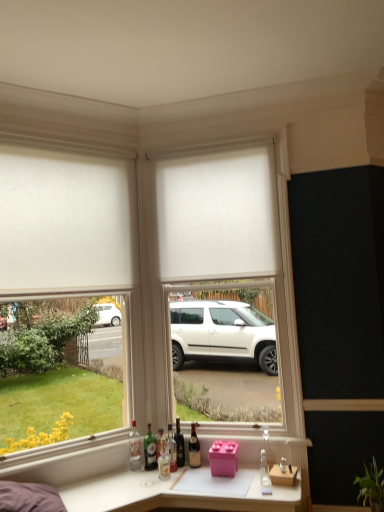
Find the location of a particular element. The image size is (384, 512). empty space that is ontop of white matte window frame at center (from a real-world perspective) is located at coordinates (216, 129).